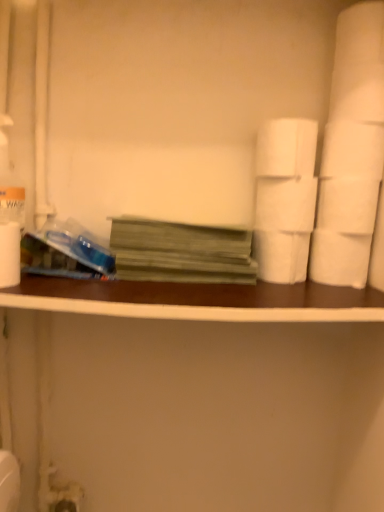
Question: Does green matte book at center have a greater width compared to white matte toilet paper at center right, the fourth toilet paper ordered from the bottom?

Choices:
 (A) no
 (B) yes

Answer: (B)

Question: Are green matte book at center and white matte toilet paper at center right, the second toilet paper when ordered from top to bottom, far apart?

Choices:
 (A) yes
 (B) no

Answer: (B)

Question: Would you say green matte book at center is outside white matte toilet paper at center right, the fourth toilet paper ordered from the bottom?

Choices:
 (A) no
 (B) yes

Answer: (B)

Question: From the image's perspective, is green matte book at center located beneath white matte toilet paper at center right, the fourth toilet paper ordered from the bottom?

Choices:
 (A) no
 (B) yes

Answer: (B)

Question: Is white matte toilet paper at center right, the fourth toilet paper ordered from the bottom, surrounded by green matte book at center?

Choices:
 (A) no
 (B) yes

Answer: (A)

Question: Is white matte toilet paper at right, which is the 3th toilet paper in bottom-to-top order, situated inside white matte toilet paper at right, the 5th toilet paper when ordered from top to bottom, or outside?

Choices:
 (A) inside
 (B) outside

Answer: (B)

Question: From the image's perspective, relative to white matte toilet paper at right, arranged as the first toilet paper when ordered from the bottom, is white matte toilet paper at right, acting as the third toilet paper starting from the top, above or below?

Choices:
 (A) below
 (B) above

Answer: (B)

Question: Considering the positions of white matte toilet paper at right, which is the 3th toilet paper in bottom-to-top order, and white matte toilet paper at right, the 5th toilet paper when ordered from top to bottom, in the image, is white matte toilet paper at right, which is the 3th toilet paper in bottom-to-top order, bigger or smaller than white matte toilet paper at right, the 5th toilet paper when ordered from top to bottom,?

Choices:
 (A) small
 (B) big

Answer: (B)

Question: In the image, is white matte toilet paper at right, which is the 3th toilet paper in bottom-to-top order, positioned in front of or behind white matte toilet paper at right, arranged as the first toilet paper when ordered from the bottom?

Choices:
 (A) front
 (B) behind

Answer: (A)

Question: Looking at their shapes, would you say white matte toilet paper at right, the second toilet paper ordered from the bottom, is wider or thinner than white matte toilet paper at upper right, which is the first toilet paper in top-to-bottom order?

Choices:
 (A) thin
 (B) wide

Answer: (B)

Question: Considering the positions of white matte toilet paper at right, arranged as the 4th toilet paper when viewed from the top, and white matte toilet paper at upper right, which is the first toilet paper in top-to-bottom order, in the image, is white matte toilet paper at right, arranged as the 4th toilet paper when viewed from the top, bigger or smaller than white matte toilet paper at upper right, which is the first toilet paper in top-to-bottom order,?

Choices:
 (A) small
 (B) big

Answer: (A)

Question: Based on their positions, is white matte toilet paper at right, the second toilet paper ordered from the bottom, located to the left or right of white matte toilet paper at upper right, which is the first toilet paper in top-to-bottom order?

Choices:
 (A) left
 (B) right

Answer: (A)

Question: From a real-world perspective, relative to white matte toilet paper at upper right, which is the first toilet paper in top-to-bottom order, is white matte toilet paper at right, the second toilet paper ordered from the bottom, vertically above or below?

Choices:
 (A) below
 (B) above

Answer: (A)

Question: In terms of width, does white matte paper towel at left look wider or thinner when compared to white matte toilet paper at upper right, the fifth toilet paper when ordered from bottom to top?

Choices:
 (A) wide
 (B) thin

Answer: (B)

Question: Considering the positions of white matte paper towel at left and white matte toilet paper at upper right, which is the first toilet paper in top-to-bottom order, in the image, is white matte paper towel at left bigger or smaller than white matte toilet paper at upper right, which is the first toilet paper in top-to-bottom order,?

Choices:
 (A) small
 (B) big

Answer: (A)